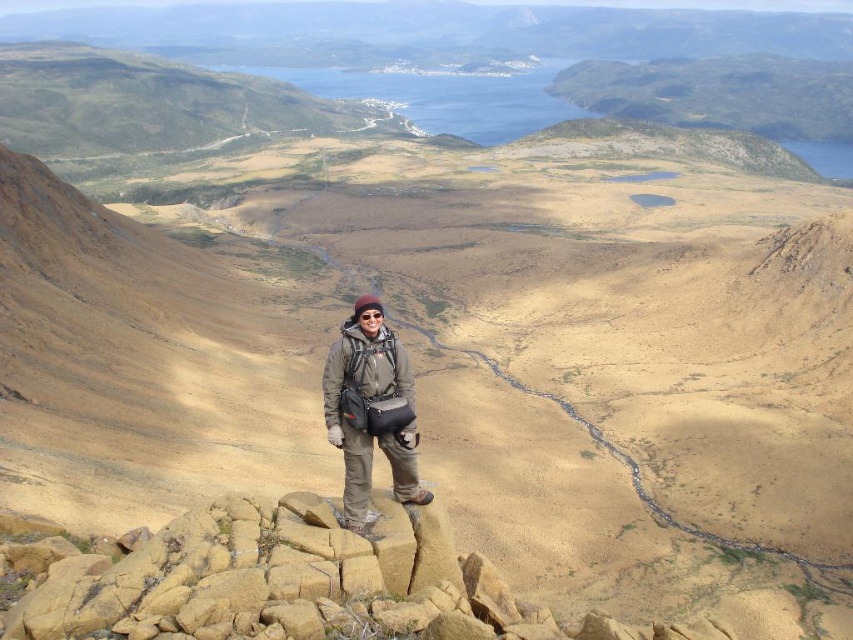
Question: Which object appears closest to the camera in this image?

Choices:
 (A) matte gray jacket at center
 (B) yellow rock at center

Answer: (B)

Question: Is yellow rock at center below matte gray jacket at center?

Choices:
 (A) no
 (B) yes

Answer: (B)

Question: Does yellow rock at center appear over matte gray jacket at center?

Choices:
 (A) yes
 (B) no

Answer: (B)

Question: Does yellow rock at center have a smaller size compared to matte gray jacket at center?

Choices:
 (A) yes
 (B) no

Answer: (B)